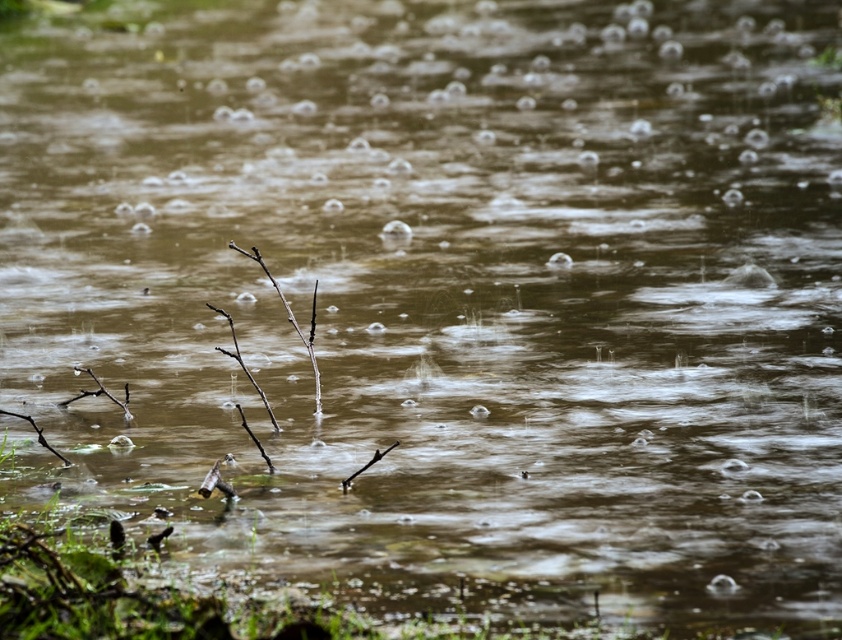
Question: Which is farther from the brown matte branch at center?

Choices:
 (A) brown woody branch at center
 (B) brown twig at lower left
 (C) brown matte branch at lower left

Answer: (B)

Question: Which point is farther to the camera?

Choices:
 (A) (291, 316)
 (B) (99, 392)
 (C) (41, 438)
 (D) (344, 483)

Answer: (B)

Question: Which point appears farthest from the camera in this image?

Choices:
 (A) (x=296, y=324)
 (B) (x=387, y=445)

Answer: (A)

Question: Is brown matte branch at lower left to the right of brown woody branch at center from the viewer's perspective?

Choices:
 (A) no
 (B) yes

Answer: (A)

Question: Does brown matte branch at center appear on the right side of brown woody branch at center?

Choices:
 (A) no
 (B) yes

Answer: (A)

Question: Does brown matte branch at lower left appear on the right side of brown woody branch at center?

Choices:
 (A) yes
 (B) no

Answer: (B)